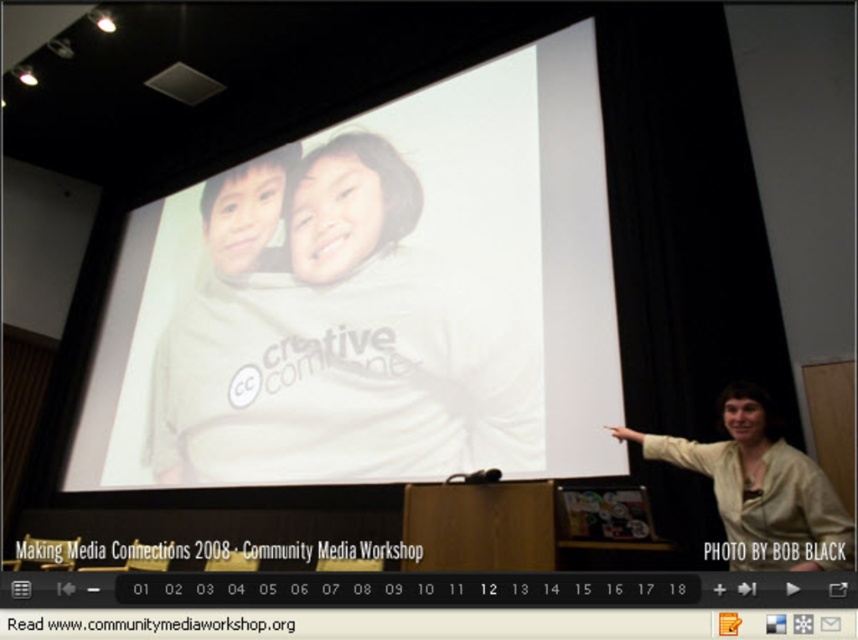
Question: Among these points, which one is farthest from the camera?

Choices:
 (A) (783, 490)
 (B) (542, 193)

Answer: (B)

Question: Estimate the real-world distances between objects in this image. Which object is farther from the yellow fabric at right?

Choices:
 (A) light beige fabric at center
 (B) white matte screen at center
 (C) matte beige hoodie at center

Answer: (A)

Question: Which object appears farthest from the camera in this image?

Choices:
 (A) white matte screen at center
 (B) yellow fabric at right

Answer: (A)

Question: Is matte beige hoodie at center thinner than light beige fabric at center?

Choices:
 (A) yes
 (B) no

Answer: (B)

Question: Does white matte screen at center have a smaller size compared to matte beige hoodie at center?

Choices:
 (A) yes
 (B) no

Answer: (B)

Question: Does yellow fabric at right appear on the left side of light beige fabric at center?

Choices:
 (A) yes
 (B) no

Answer: (B)